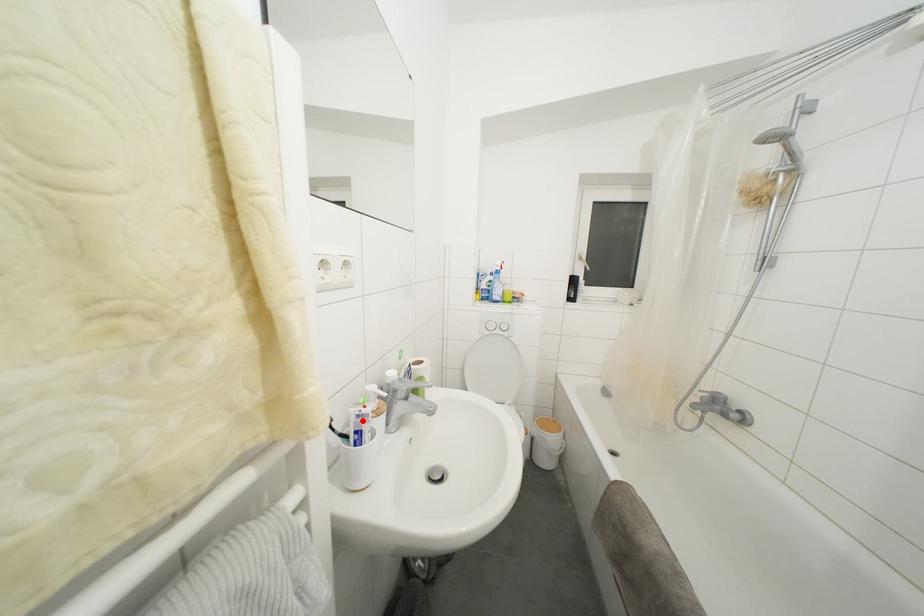
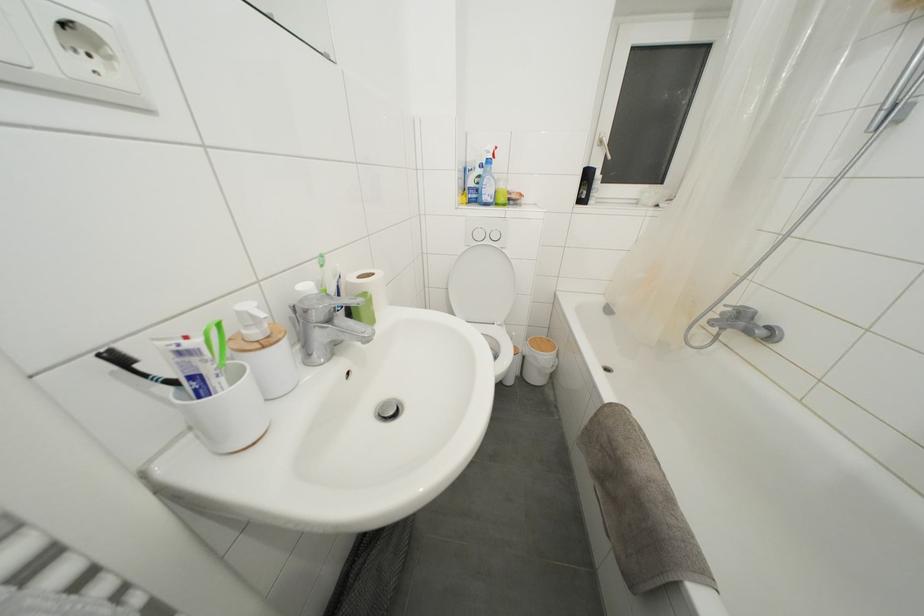
In the second image, find the point that corresponds to the highlighted location in the first image.

(185, 358)